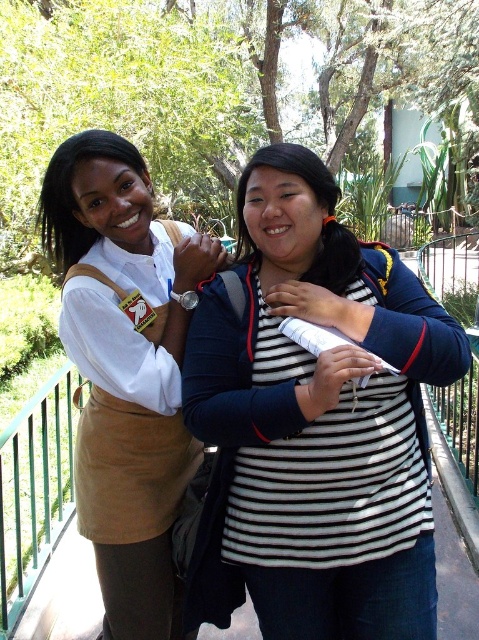
Based on the photo, you are a photographer trying to capture a group photo of the two people in the image. The photographer wants to ensure both subjects are in focus. The camera has a depth of field that can cover up to 5 feet. Can the photographer capture both the black striped shirt at center and the other person clearly in the same shot?

The two people are 5.54 feet apart, which exceeds the camera depth of field of 5 feet. Therefore, the photographer cannot capture both the black striped shirt at center and the other person clearly in the same shot.

You are a photographer trying to capture a clear shot of the matte khaki skirt at center. However, the black striped shirt at center is blocking your view. Can you determine if the skirt is visible behind the shirt?

The black striped shirt at center is positioned over matte khaki skirt at center, so the skirt is not visible behind the shirt.